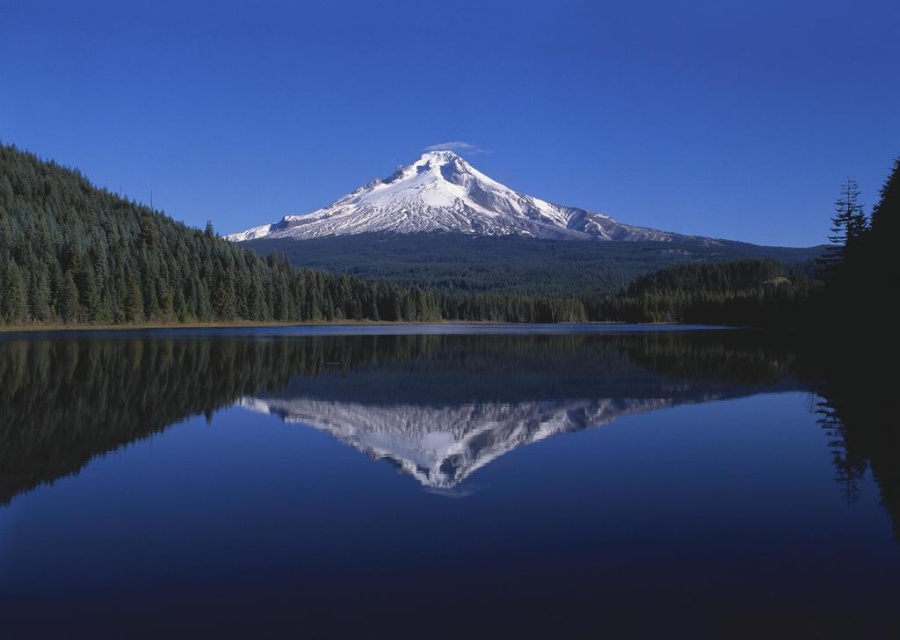
In the scene shown: You are a photographer standing at the edge of the lake in the image. You want to capture the reflection of Mount Hood in the transparent glass water at center. Based on the scene description, where should you position your camera to ensure the reflection is centered in your shot?

To center the reflection of Mount Hood in the transparent glass water at center, position your camera at the point specified by the coordinates provided in the description, which is at point (441, 486). This location ensures the reflection is perfectly centered in your shot.

You are standing at the edge of the lake in the image. You see a point marked as point (441, 486) which is transparent glass water at center. What is the nature of the surface at that point?

The point (441, 486) indicates transparent glass water at center, so the surface there is transparent and glassy, allowing clear reflection of the surroundings.